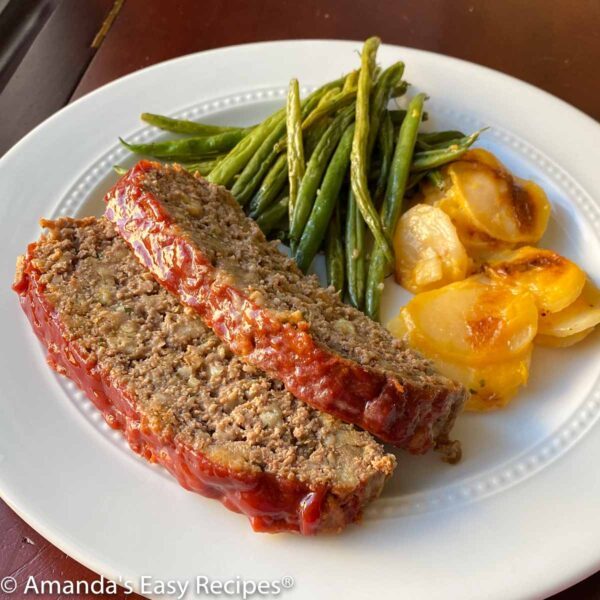
Find the location of a particular element. This screenshot has height=600, width=600. dotted border around center edge of plate is located at coordinates (514, 467), (89, 181), (227, 102), (538, 161).